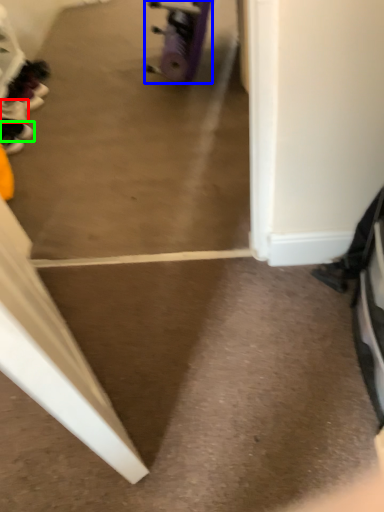
Question: Which object is positioned farthest from footwear (highlighted by a red box)? Select from wheel (highlighted by a blue box) and footwear (highlighted by a green box).

Choices:
 (A) wheel
 (B) footwear

Answer: (A)